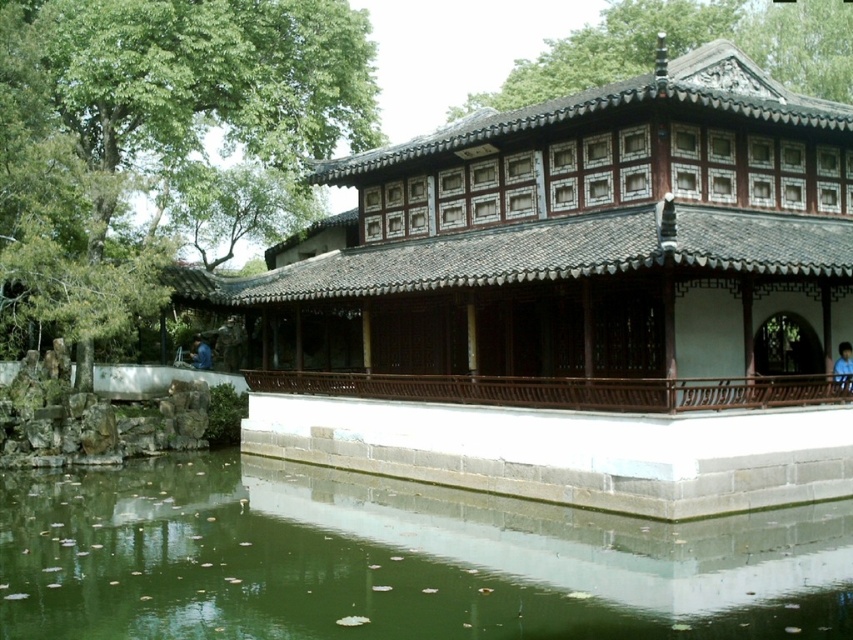
Consider the image. You are standing at the camera position and want to take a photo of the brown wooden palace at center. If your camera has a maximum zoom range of 10 meters, can you capture the entire palace in the photo without moving closer?

The distance between you and the brown wooden palace at center is 17.91 meters, which exceeds the camera maximum zoom range of 10 meters. Therefore, you cannot capture the entire palace in the photo without moving closer.

You are a visitor standing at the edge of the green water at lower left, looking towards the brown wooden palace at center. Which object is higher in elevation?

The brown wooden palace at center is much taller than the green water at lower left, so the brown wooden palace at center is higher in elevation.

You are standing at the edge of the water and see the brown wooden palace at center marked by point (585, 298). If you walk straight towards the palace, will you reach it before the water ends?

The brown wooden palace at center is represented by point (585, 298), so yes, walking straight towards it from the edge would lead you to the palace before the water ends since the palace is positioned centrally over the water.